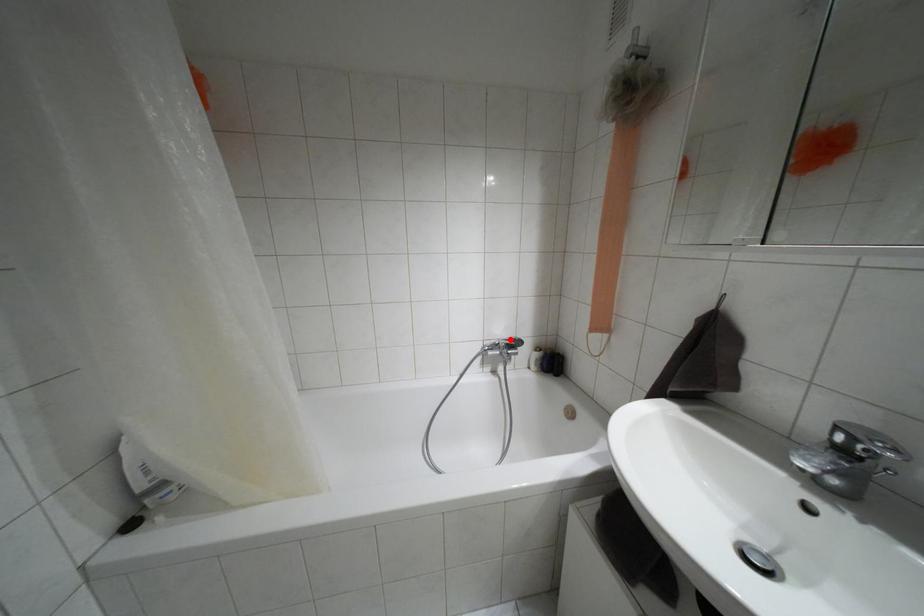
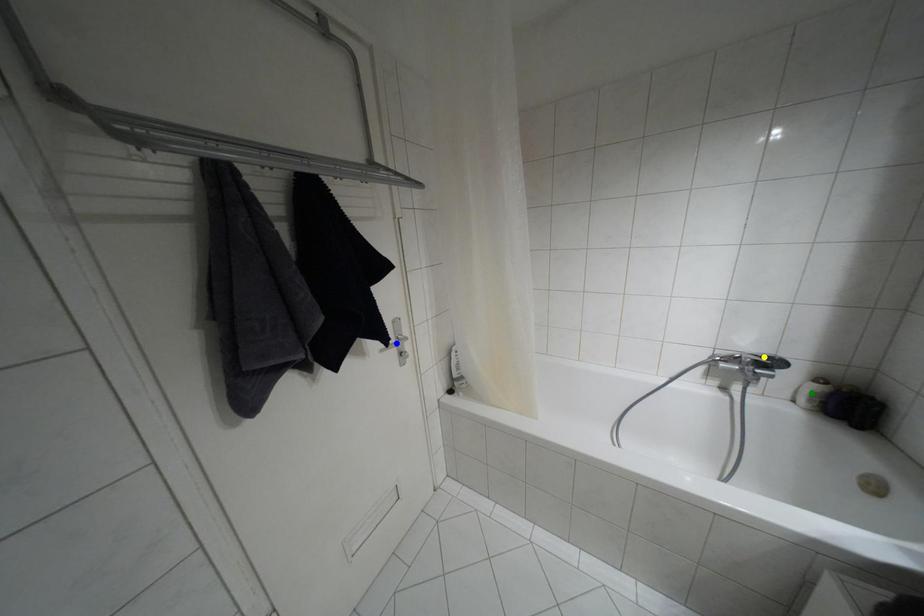
Question: I am providing you with two images of the same scene from different viewpoints. A red point is marked on the first image. You are given multiple points on the second image. Which point in image 2 is actually the same real-world point as the red point in image 1?

Choices:
 (A) blue point
 (B) green point
 (C) yellow point

Answer: (C)